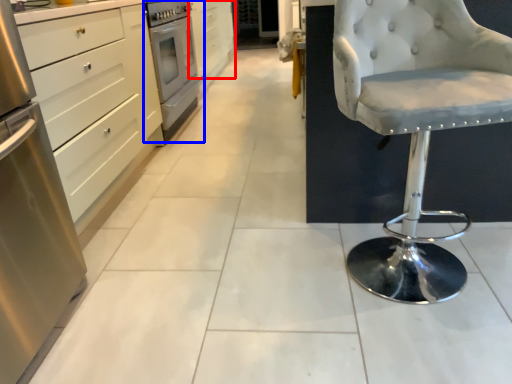
Question: Among these objects, which one is farthest to the camera, cabinetry (highlighted by a red box) or home appliance (highlighted by a blue box)?

Choices:
 (A) cabinetry
 (B) home appliance

Answer: (A)